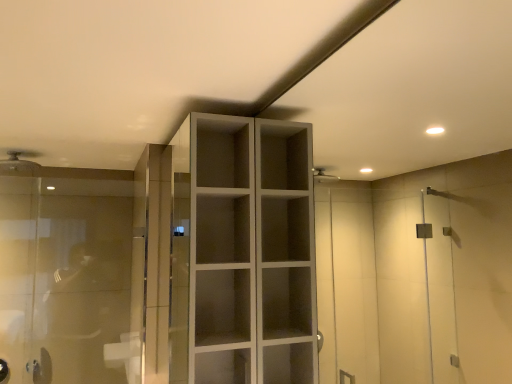
At what (x,y) coordinates should I click in order to perform the action: click on matte white shower head at upper left. Please return your answer as a coordinate pair (x, y). Image resolution: width=512 pixels, height=384 pixels. Looking at the image, I should click on coord(19,163).

Is transparent glass door at left facing towards matte white cupboard at center?

No, transparent glass door at left is not facing towards matte white cupboard at center.

Would you say transparent glass door at left contains matte white cupboard at center?

No, matte white cupboard at center is not inside transparent glass door at left.

Which object is positioned more to the right, transparent glass door at left or matte white cupboard at center?

matte white cupboard at center is more to the right.

From a real-world perspective, which object rests below the other?

transparent glass door at left is physically lower.

Is matte white shower head at upper left to the left or to the right of transparent glass door at left in the image?

In the image, matte white shower head at upper left appears on the left side of transparent glass door at left.

Are matte white shower head at upper left and transparent glass door at left located far from each other?

No, there isn't a large distance between matte white shower head at upper left and transparent glass door at left.

Looking at this image, is matte white shower head at upper left located outside transparent glass door at left?

Indeed, matte white shower head at upper left is completely outside transparent glass door at left.

Does matte white cupboard at center appear on the right side of transparent glass door at left?

Indeed, matte white cupboard at center is positioned on the right side of transparent glass door at left.

From a real-world perspective, is matte white cupboard at center physically located above or below transparent glass door at left?

In terms of real-world spatial position, matte white cupboard at center is above transparent glass door at left.

Would you say matte white cupboard at center contains transparent glass door at left?

Actually, transparent glass door at left is outside matte white cupboard at center.

Is matte white cupboard at center taller or shorter than transparent glass door at left?

In the image, matte white cupboard at center appears to be shorter than transparent glass door at left.

Does point (80, 258) lie behind point (9, 167)?

Yes, it is.

Looking at the image, does transparent glass door at left seem bigger or smaller compared to matte white shower head at upper left?

Considering their sizes, transparent glass door at left takes up more space than matte white shower head at upper left.

Is transparent glass door at left at the left side of matte white shower head at upper left?

No.

Could you tell me if matte white cupboard at center is facing matte white shower head at upper left?

No, matte white cupboard at center does not turn towards matte white shower head at upper left.

Is point (298, 220) less distant than point (21, 166)?

Yes, point (298, 220) is closer to viewer.

Find the location of a particular element. shower to the left of matte white cupboard at center is located at coordinates (19, 163).

Can you confirm if matte white cupboard at center is thinner than matte white shower head at upper left?

Indeed, matte white cupboard at center has a lesser width compared to matte white shower head at upper left.

Considering the sizes of objects matte white shower head at upper left and matte white cupboard at center in the image provided, who is wider, matte white shower head at upper left or matte white cupboard at center?

Wider between the two is matte white shower head at upper left.

Considering the relative sizes of matte white shower head at upper left and matte white cupboard at center in the image provided, is matte white shower head at upper left shorter than matte white cupboard at center?

Yes.

From a real-world perspective, is matte white shower head at upper left under matte white cupboard at center?

Actually, matte white shower head at upper left is physically above matte white cupboard at center in the real world.

Is point (1, 163) positioned after point (200, 382)?

Yes, point (1, 163) is farther from viewer.

Identify the location of cupboard above the transparent glass door at left (from the image's perspective). Image resolution: width=512 pixels, height=384 pixels. (245, 253).

The height and width of the screenshot is (384, 512). Identify the location of shower above the transparent glass door at left (from a real-world perspective). 19,163.

Estimate the real-world distances between objects in this image. Which object is further from transparent glass door at left, matte white shower head at upper left or matte white cupboard at center?

matte white cupboard at center lies further to transparent glass door at left than the other object.

Estimate the real-world distances between objects in this image. Which object is closer to matte white shower head at upper left, transparent glass door at left or matte white cupboard at center?

transparent glass door at left.

Estimate the real-world distances between objects in this image. Which object is closer to matte white cupboard at center, matte white shower head at upper left or transparent glass door at left?

Based on the image, transparent glass door at left appears to be nearer to matte white cupboard at center.

Which object lies nearer to the anchor point transparent glass door at left, matte white cupboard at center or matte white shower head at upper left?

Based on the image, matte white shower head at upper left appears to be nearer to transparent glass door at left.

Estimate the real-world distances between objects in this image. Which object is further from matte white shower head at upper left, matte white cupboard at center or transparent glass door at left?

Among the two, matte white cupboard at center is located further to matte white shower head at upper left.

Estimate the real-world distances between objects in this image. Which object is closer to matte white cupboard at center, transparent glass door at left or matte white shower head at upper left?

transparent glass door at left.

Identify the location of glass door between matte white shower head at upper left and matte white cupboard at center from left to right. (66, 275).